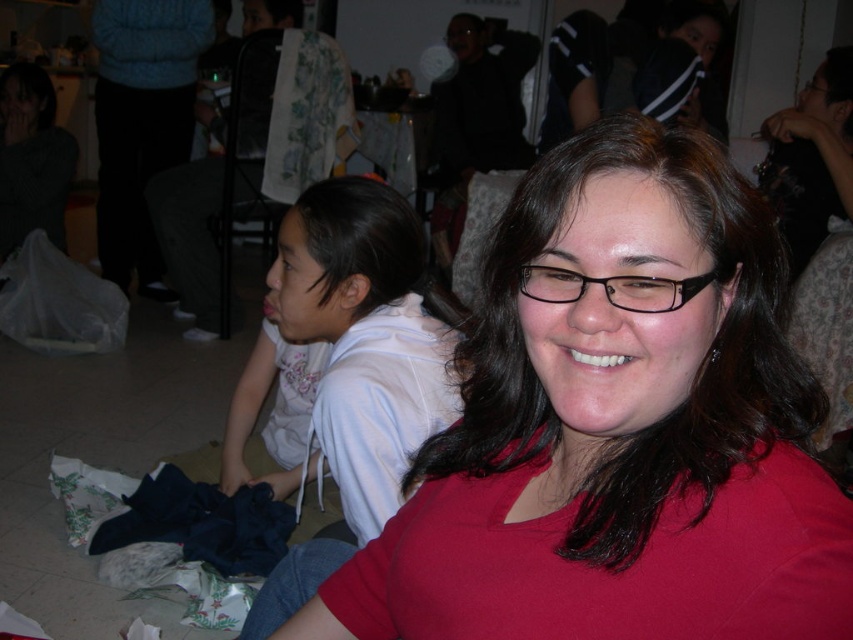
You are at a party and want to find the black plastic glasses at center. Which object is located to the right of the white cotton hoodie at lower left?

The black plastic glasses at center is located to the right of the white cotton hoodie at lower left.

Consider the image. You are at the point labeled point (421, 394) and want to move to the point labeled point (537, 298). Is the destination closer to or farther from the camera than your current position?

The destination point (537, 298) is farther from the camera than your current position at point (421, 394).

You are a photographer trying to capture a clear shot of the matte red shirt at center and the black plastic glasses at center. Which object should you focus on first if you want to ensure both are in focus, considering their sizes?

The matte red shirt at center is larger in size than the black plastic glasses at center, so you should focus on the matte red shirt at center first to ensure both are in focus.